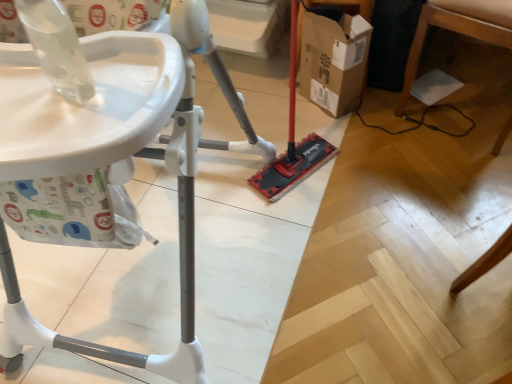
Image resolution: width=512 pixels, height=384 pixels. In order to click on vacant area located to the right-hand side of white plastic high chair at left, which appears as the 1th furniture when viewed from the left in this screenshot , I will do `click(375, 253)`.